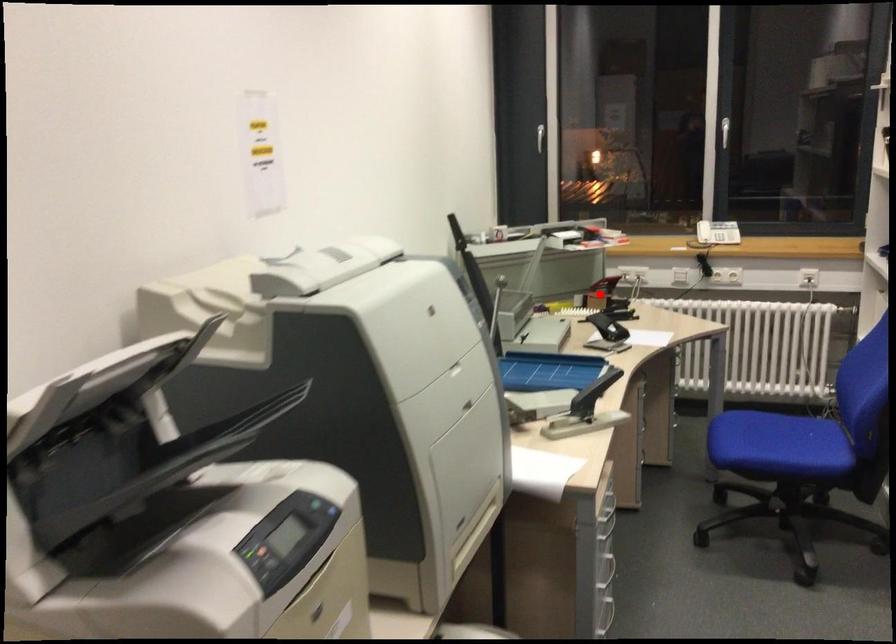
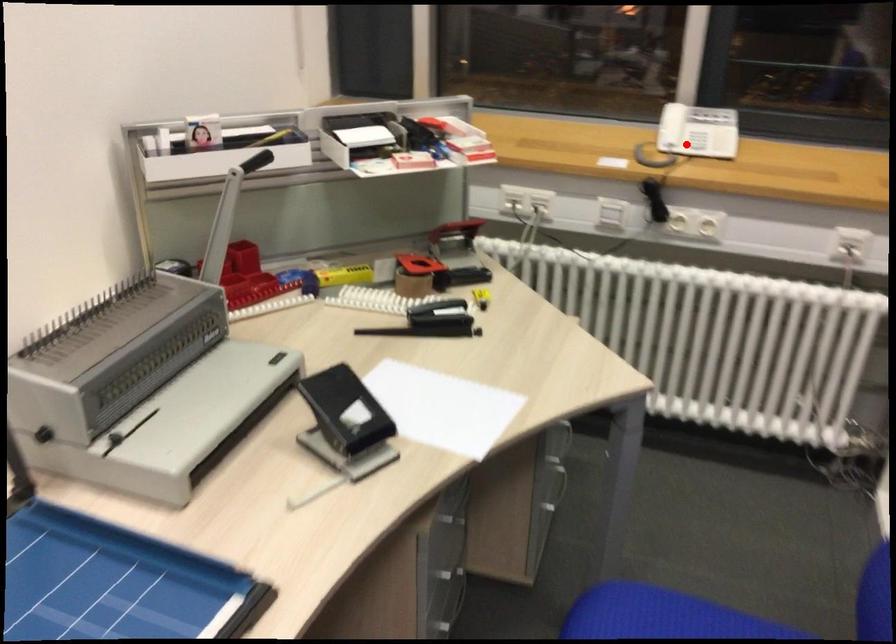
I am providing you with two images of the same scene from different viewpoints. A red point is marked on the first image and another point is marked on the second image. Is the marked point in image1 the same physical position as the marked point in image2?

No